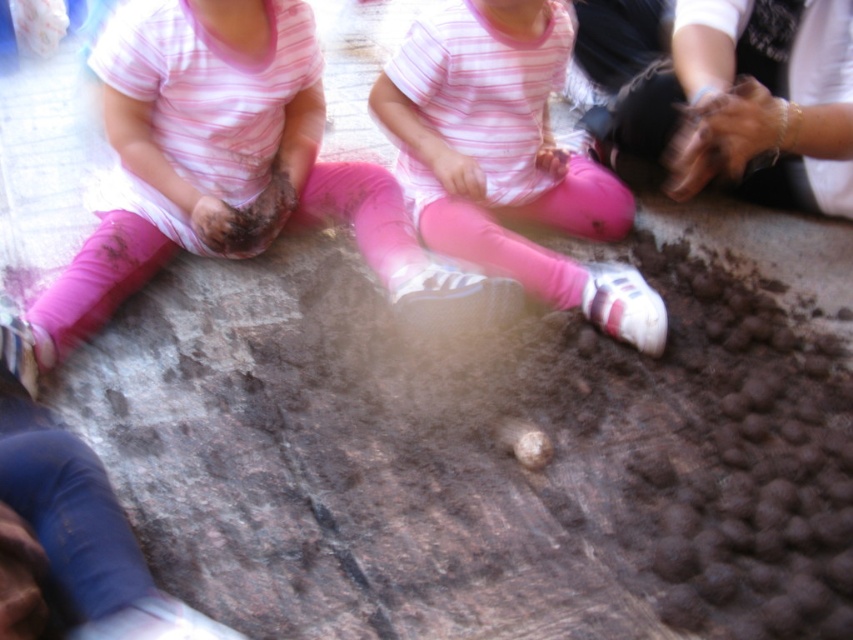
Question: Which point is farther to the camera?

Choices:
 (A) pink fabric pants at center
 (B) pink matte leggings at lower left

Answer: (A)

Question: Does pink matte leggings at lower left appear over pink fabric pants at center?

Choices:
 (A) yes
 (B) no

Answer: (B)

Question: Is pink matte leggings at lower left further to camera compared to pink fabric pants at center?

Choices:
 (A) yes
 (B) no

Answer: (B)

Question: Does pink matte leggings at lower left have a smaller size compared to pink fabric pants at center?

Choices:
 (A) no
 (B) yes

Answer: (A)